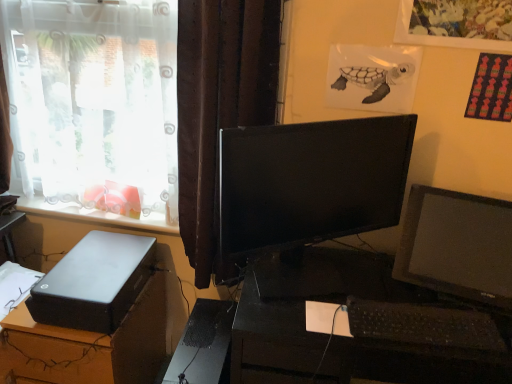
Identify the location of vacant area situated below black plastic keyboard at lower right (from a real-world perspective). (424, 324).